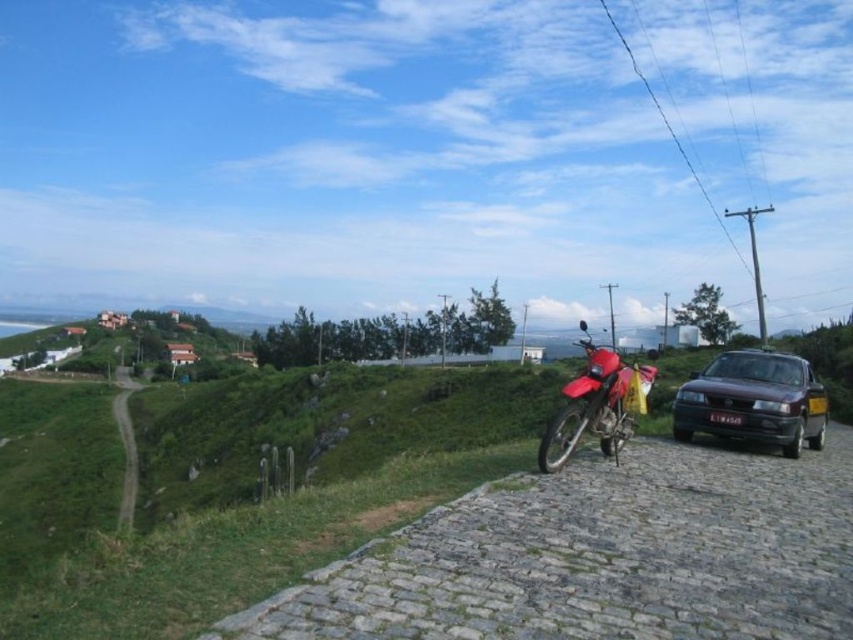
You are a delivery person who needs to attach a GPS tracker to the red matte motorcycle at center. The GPS tracker is the size of the black plastic license plate at right. Will the GPS tracker fit on the motorcycle?

The red matte motorcycle at center is bigger than the black plastic license plate at right. Since the GPS tracker is the size of the license plate, it will fit on the motorcycle.

You are standing at the center of the cobblestone road in the image. You want to locate the red matte motorcycle at center. In which direction should you look relative to your position?

The red matte motorcycle at center is located at point coordinates of 0.764 on the x axis and 0.279 on the y axis. Since you are standing at the center of the cobblestone road, which is the origin point, you should look towards the right and slightly downward direction to find the red matte motorcycle at center.

You are a delivery person who needs to load a package onto the red matte motorcycle at center. However, there is a black plastic license plate at right nearby. Can you easily access the motorcycle without moving the license plate?

The red matte motorcycle at center is positioned under the black plastic license plate at right, which means the license plate is above the motorcycle. Since the license plate is part of the motorcycle, you can easily access the motorcycle without needing to move it.